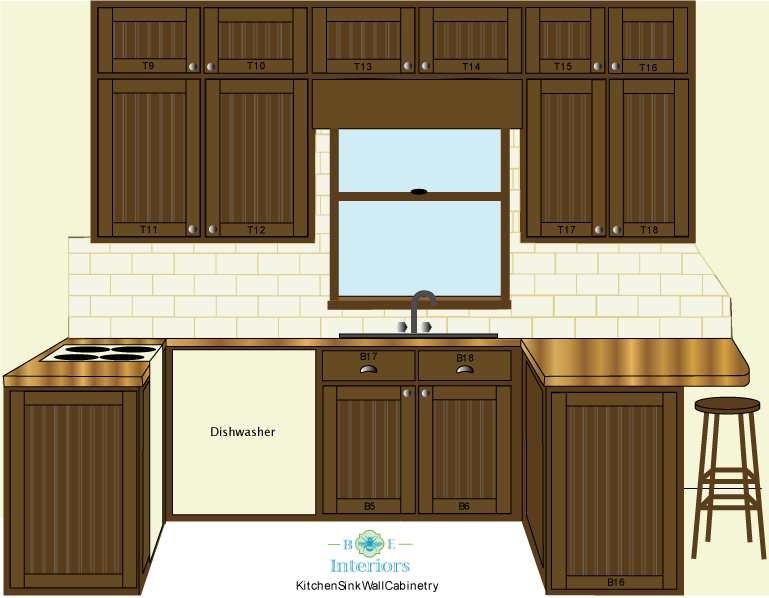
Where is `drawers`? This screenshot has width=769, height=598. drawers is located at coordinates (485, 373), (410, 373).